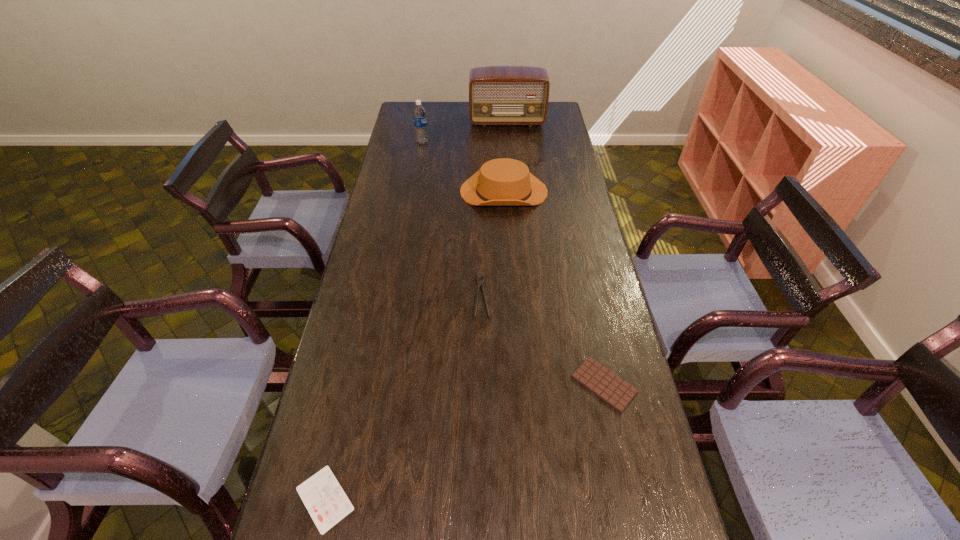
This screenshot has width=960, height=540. I want to click on free spot between the water bottle and the tallest object, so click(465, 132).

You are a GUI agent. You are given a task and a screenshot of the screen. Output one action in this format:
    pyautogui.click(x=<x>, y=<y>)
    Task: Click on the vacant area that lies between the farthest object and the water bottle
    The width and height of the screenshot is (960, 540).
    Given the screenshot: What is the action you would take?
    click(465, 132)

Find the location of a particular element. This screenshot has height=540, width=960. vacant space that is in between the fourth tallest object and the fifth nearest object is located at coordinates (452, 219).

You are a GUI agent. You are given a task and a screenshot of the screen. Output one action in this format:
    pyautogui.click(x=<x>, y=<y>)
    Task: Click on the empty space that is in between the second shortest object and the fourth farthest object
    
    Given the screenshot: What is the action you would take?
    pyautogui.click(x=543, y=340)

Where is `free space between the fifth shortest object and the shortest object`? free space between the fifth shortest object and the shortest object is located at coordinates (373, 320).

Locate an element on the screen. free space between the fifth nearest object and the fourth nearest object is located at coordinates (463, 167).

In order to click on unoccupied position between the third nearest object and the second shortest object in this screenshot , I will do `click(543, 340)`.

The width and height of the screenshot is (960, 540). I want to click on vacant region between the radio receiver and the tongs, so click(x=494, y=209).

Image resolution: width=960 pixels, height=540 pixels. Identify the location of vacant space in between the tallest object and the cowboy hat. (505, 157).

The image size is (960, 540). I want to click on object that ranks as the fifth closest to the farthest object, so click(x=322, y=495).